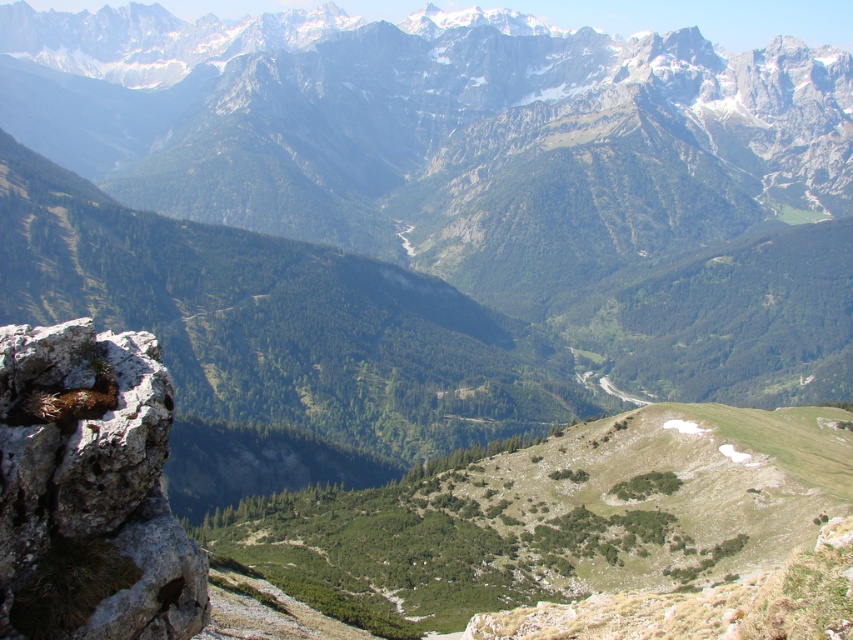
Question: Does green grassy hillside at center appear on the left side of gray rough rock at lower left?

Choices:
 (A) no
 (B) yes

Answer: (A)

Question: Is green grassy hillside at center smaller than gray rough rock at lower left?

Choices:
 (A) yes
 (B) no

Answer: (B)

Question: Is green grassy hillside at center thinner than gray rough rock at lower left?

Choices:
 (A) yes
 (B) no

Answer: (B)

Question: Which object is farther from the camera taking this photo?

Choices:
 (A) green grassy hillside at center
 (B) gray rough rock at lower left

Answer: (A)